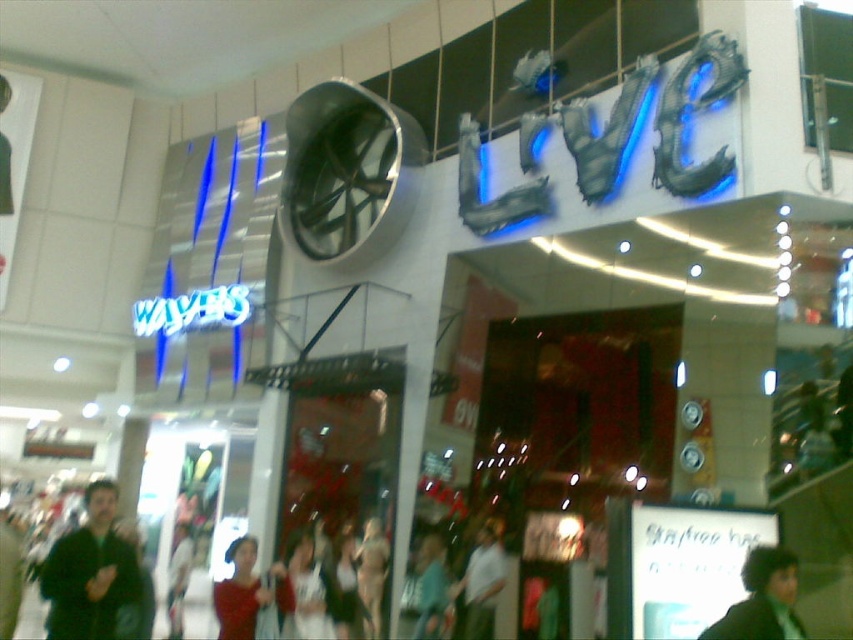
Question: Does dark brown hair at lower right have a smaller size compared to light blue denim jeans at lower center?

Choices:
 (A) yes
 (B) no

Answer: (A)

Question: Which point appears farthest from the camera in this image?

Choices:
 (A) (758, 556)
 (B) (68, 586)
 (C) (271, 566)
 (D) (424, 584)

Answer: (D)

Question: Which point is closer to the camera?

Choices:
 (A) (331, 628)
 (B) (234, 580)
 (C) (416, 618)
 (D) (762, 595)

Answer: (D)

Question: Can you confirm if dark brown hair at lower right is positioned below light blue denim jeans at lower center?

Choices:
 (A) yes
 (B) no

Answer: (B)

Question: Which object is closer to the camera taking this photo?

Choices:
 (A) white matte shirt at center
 (B) dark green jacket at lower left

Answer: (B)

Question: Does dark green jacket at lower left have a smaller size compared to dark brown hair at lower right?

Choices:
 (A) yes
 (B) no

Answer: (B)